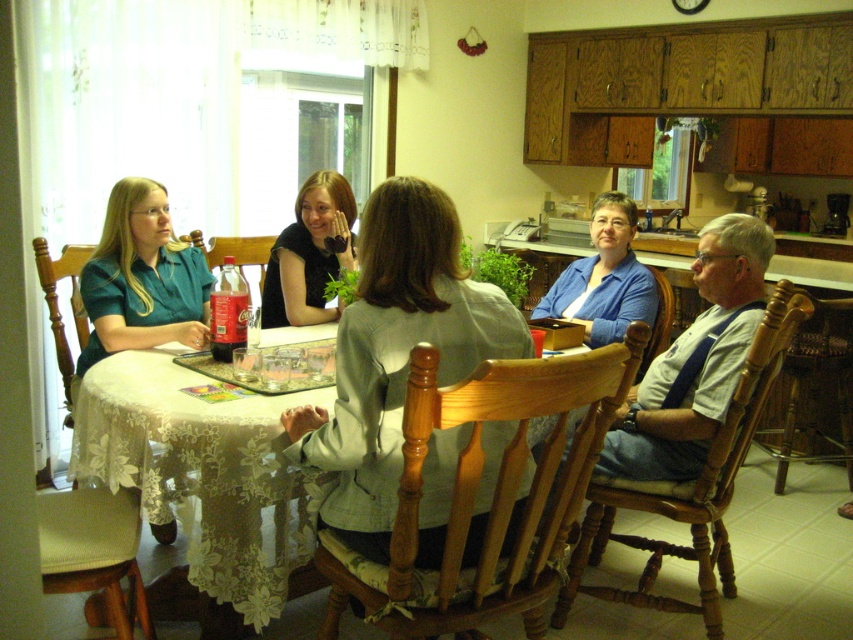
Question: Which of the following is the farthest from the observer?

Choices:
 (A) (285, 508)
 (B) (165, 243)

Answer: (B)

Question: Where is white lace tablecloth at center located in relation to matte black shirt at center in the image?

Choices:
 (A) left
 (B) right

Answer: (A)

Question: Where is white lace tablecloth at center located in relation to matte teal blouse at left in the image?

Choices:
 (A) left
 (B) right

Answer: (B)

Question: Considering the real-world distances, which object is farthest from the white lace tablecloth at center?

Choices:
 (A) matte teal blouse at left
 (B) matte black shirt at center

Answer: (B)

Question: Among these objects, which one is farthest from the camera?

Choices:
 (A) white lace tablecloth at center
 (B) matte teal blouse at left

Answer: (B)

Question: Can you confirm if white lace tablecloth at center is positioned above matte black shirt at center?

Choices:
 (A) no
 (B) yes

Answer: (A)